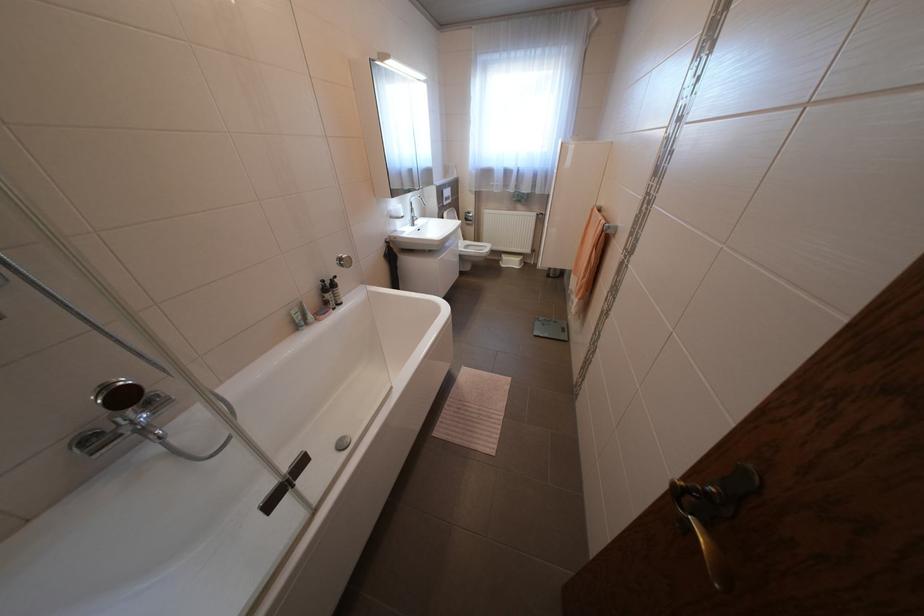
Where would you lift the bathtub faucet handle? Please return your answer as a coordinate pair (x, y).

(132, 408)